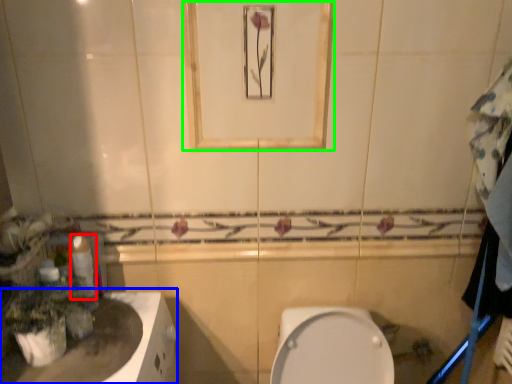
Question: Considering the real-world distances, which object is farthest from toilet paper (highlighted by a red box)? counter top (highlighted by a blue box) or mirror (highlighted by a green box)?

Choices:
 (A) counter top
 (B) mirror

Answer: (B)